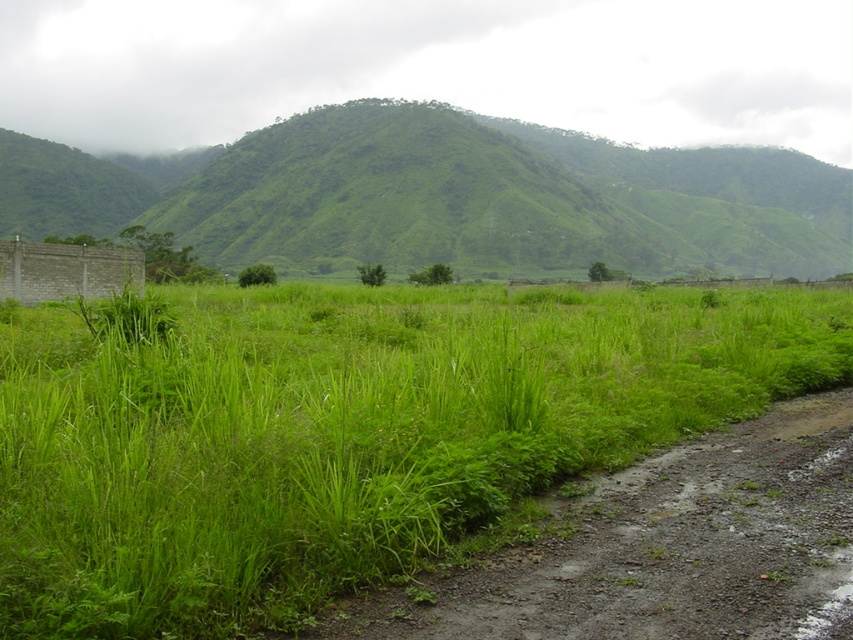
Is green grassy field at center to the left of damp gravel path at lower right from the viewer's perspective?

Incorrect, green grassy field at center is not on the left side of damp gravel path at lower right.

Is point (763, 292) closer to camera compared to point (341, 616)?

No, (763, 292) is further to viewer.

Identify the location of green grassy field at center. (345, 433).

You are a GUI agent. You are given a task and a screenshot of the screen. Output one action in this format:
    pyautogui.click(x=<x>, y=<y>)
    Task: Click on the green grassy field at center
    This screenshot has height=640, width=853.
    Given the screenshot: What is the action you would take?
    pyautogui.click(x=345, y=433)

The image size is (853, 640). What are the coordinates of `green grassy hill at left` in the screenshot? It's located at (450, 196).

Between green grassy hill at left and damp gravel path at lower right, which one appears on the right side from the viewer's perspective?

From the viewer's perspective, green grassy hill at left appears more on the right side.

This screenshot has height=640, width=853. What are the coordinates of `green grassy hill at left` in the screenshot? It's located at (450, 196).

Can you confirm if green grassy field at center is bigger than green grassy hill at left?

Actually, green grassy field at center might be smaller than green grassy hill at left.

Which is more to the right, green grassy field at center or green grassy hill at left?

Positioned to the right is green grassy field at center.

Between point (517, 365) and point (270, 252), which one is positioned behind?

Positioned behind is point (270, 252).

In order to click on green grassy field at center in this screenshot , I will do `click(345, 433)`.